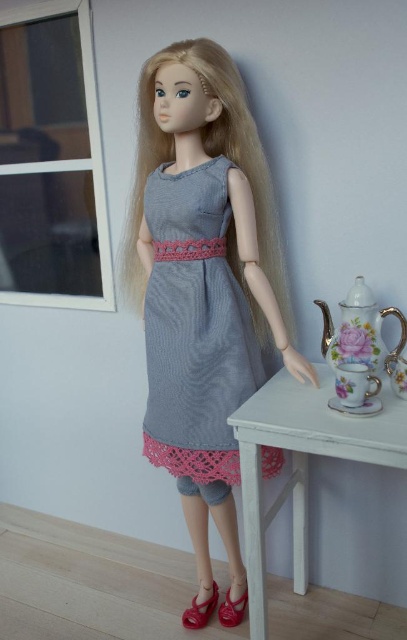
You are a customer in a shoe store looking at the shiny red leather shoe at lower center and the matte red shoe at lower center. Which one has a higher height?

The shiny red leather shoe at lower center is taller than the matte red shoe at lower center.

You are a fashion designer who wants to place a knitted denim dress at center on a mannequin. The mannequin is currently 4 feet away from the dress. Can the dress be moved to the mannequin without exceeding the 5 feet distance limit?

The knitted denim dress at center is 4.57 feet away from the mannequin. Since 4.57 feet is less than 5 feet, the dress can be moved to the mannequin without exceeding the distance limit.

You are standing in the room where the doll is placed. There are two points marked in the image. The first point is at coordinates point (144, 208) and the second is at point (242, 609). Which of these two points is closer to you?

Point (144, 208) is closer to the viewer than point (242, 609).